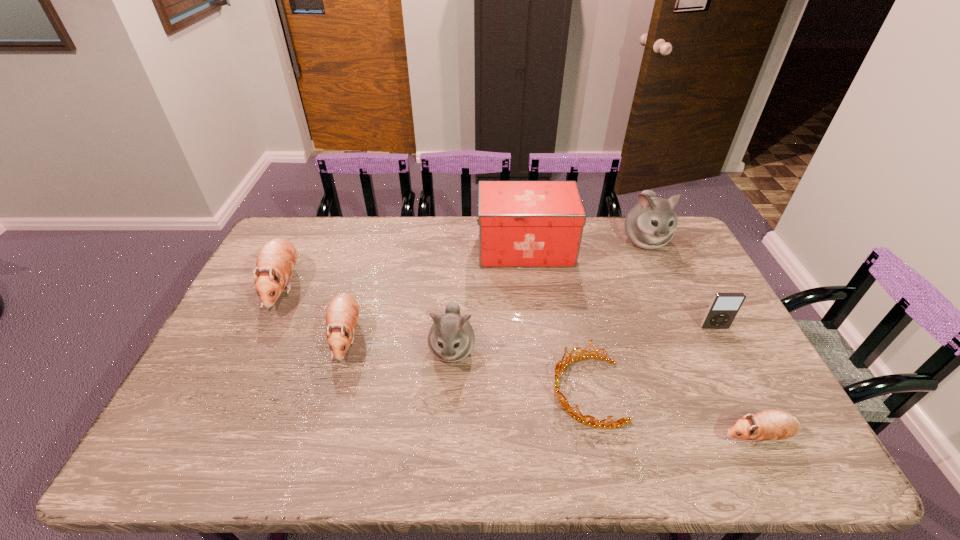
Find the location of `the first-aid kit`. the first-aid kit is located at coordinates (521, 223).

Where is `the farther white hamster`? This screenshot has height=540, width=960. the farther white hamster is located at coordinates (650, 224).

The image size is (960, 540). Identify the location of the bigger white hamster. (650, 224).

This screenshot has width=960, height=540. Identify the location of the nearer white hamster. (451, 338).

Find the location of a particular element. the left white hamster is located at coordinates (451, 338).

Locate an element on the screen. The width and height of the screenshot is (960, 540). the leftmost object is located at coordinates (276, 260).

Image resolution: width=960 pixels, height=540 pixels. Identify the location of the leftmost brown hamster. pos(276,260).

The width and height of the screenshot is (960, 540). Find the location of `iPod`. iPod is located at coordinates (724, 307).

Locate an element on the screen. The height and width of the screenshot is (540, 960). the second brown hamster from right to left is located at coordinates (342, 313).

Identify the location of the fourth hamster from right to left. The width and height of the screenshot is (960, 540). (342, 313).